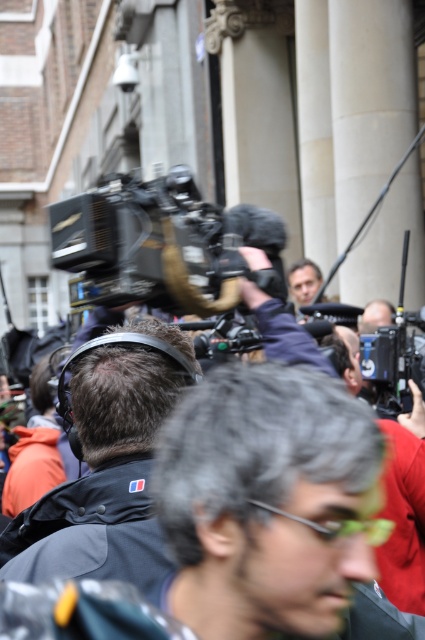
Question: Estimate the real-world distances between objects in this image. Which object is closer to the dark gray fabric headphones at center?

Choices:
 (A) matte black camera at center
 (B) black plastic video camera at center

Answer: (B)

Question: Does black plastic video camera at center have a smaller size compared to dark gray fabric headphones at center?

Choices:
 (A) no
 (B) yes

Answer: (A)

Question: Can you confirm if black plastic video camera at center is positioned below dark gray fabric headphones at center?

Choices:
 (A) no
 (B) yes

Answer: (A)

Question: Which point appears farthest from the camera in this image?

Choices:
 (A) (107, 490)
 (B) (147, 212)
 (C) (294, 298)

Answer: (C)

Question: Can you confirm if black plastic video camera at center is positioned above dark gray fabric headphones at center?

Choices:
 (A) yes
 (B) no

Answer: (A)

Question: Among these points, which one is nearest to the camera?

Choices:
 (A) (183, 296)
 (B) (292, 280)
 (C) (102, 474)

Answer: (A)